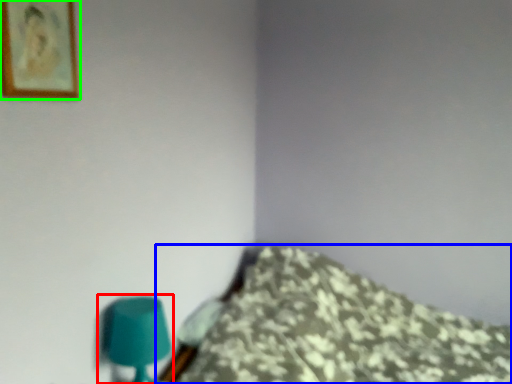
Question: Which object is the farthest from table lamp (highlighted by a red box)? Choose among these: furniture (highlighted by a blue box) or picture frame (highlighted by a green box).

Choices:
 (A) furniture
 (B) picture frame

Answer: (A)